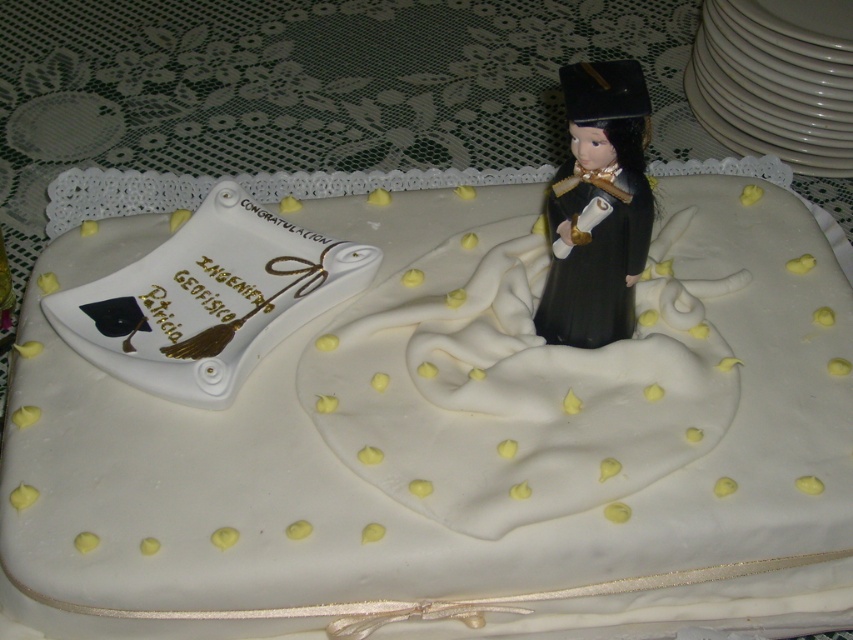
Question: Which object appears farthest from the camera in this image?

Choices:
 (A) black matte figurine at upper right
 (B) white fondant cake at center

Answer: (B)

Question: Which point is closer to the camera?

Choices:
 (A) black matte figurine at upper right
 (B) white fondant cake at center

Answer: (A)

Question: Is black matte figurine at upper right closer to camera compared to white porcelain platter at upper right?

Choices:
 (A) no
 (B) yes

Answer: (B)

Question: Is white fondant cake at center positioned behind black matte figurine at upper right?

Choices:
 (A) yes
 (B) no

Answer: (A)

Question: Does white fondant cake at center appear on the right side of white porcelain platter at upper right?

Choices:
 (A) no
 (B) yes

Answer: (A)

Question: Which point is farther from the camera taking this photo?

Choices:
 (A) (766, 529)
 (B) (630, 256)
 (C) (697, 38)

Answer: (C)